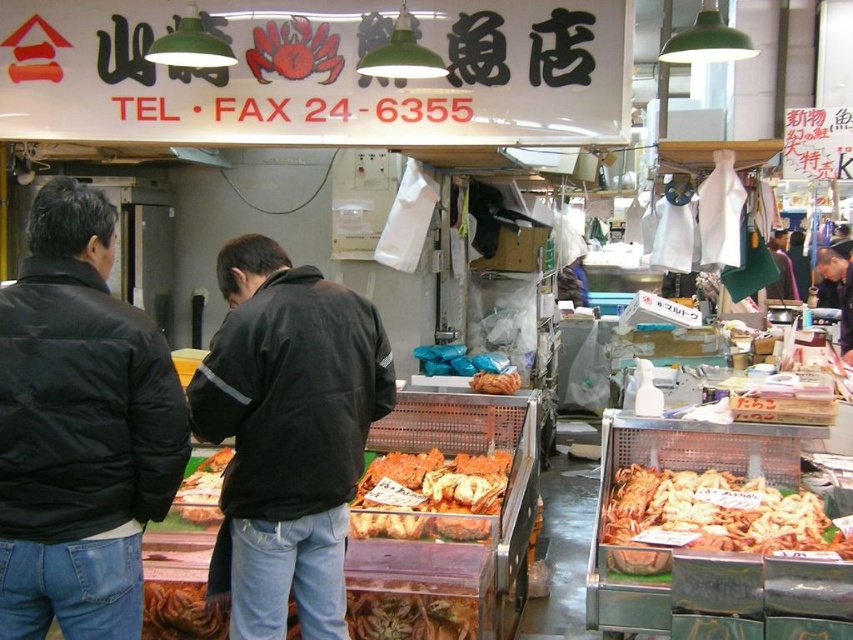
What do you see at coordinates (430, 496) in the screenshot? Image resolution: width=853 pixels, height=640 pixels. I see `golden crispy shrimp at center` at bounding box center [430, 496].

Between golden crispy shrimp at center and shiny plastic tray at center, which one appears on the right side from the viewer's perspective?

Positioned to the right is golden crispy shrimp at center.

Where is `golden crispy shrimp at center`? golden crispy shrimp at center is located at coordinates (430, 496).

Locate an element on the screen. golden crispy shrimp at center is located at coordinates (430, 496).

In the scene shown: Who is higher up, shiny golden prawns at center or shiny plastic tray at center?

Positioned higher is shiny plastic tray at center.

Which is below, shiny golden prawns at center or shiny plastic tray at center?

Positioned lower is shiny golden prawns at center.

The height and width of the screenshot is (640, 853). What do you see at coordinates (715, 513) in the screenshot? I see `shiny golden prawns at center` at bounding box center [715, 513].

Find the location of a particular element. This screenshot has width=853, height=640. shiny golden prawns at center is located at coordinates (715, 513).

Does shiny brown shrimp at center appear on the right side of dark gray jacket at center?

No, shiny brown shrimp at center is not to the right of dark gray jacket at center.

The height and width of the screenshot is (640, 853). I want to click on shiny brown shrimp at center, so coord(410,614).